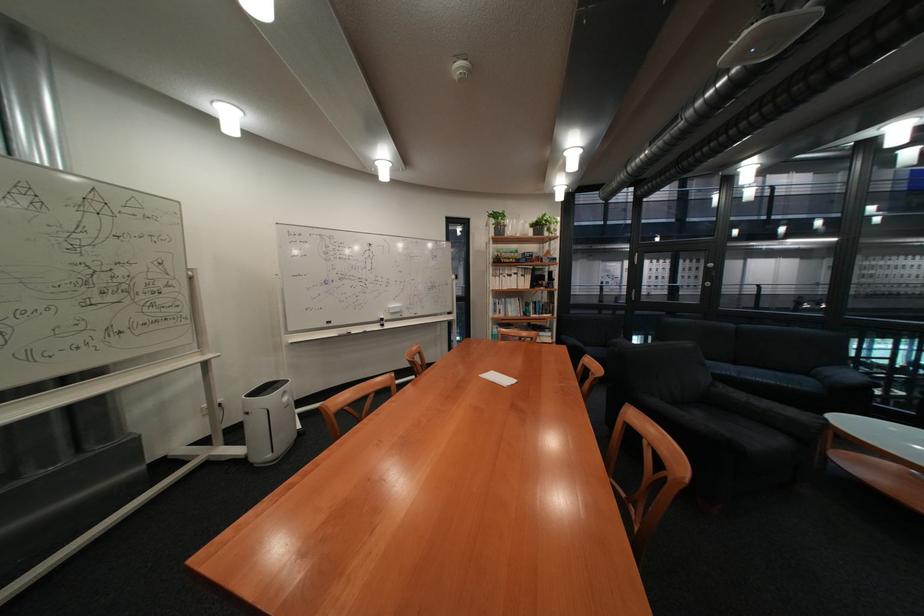
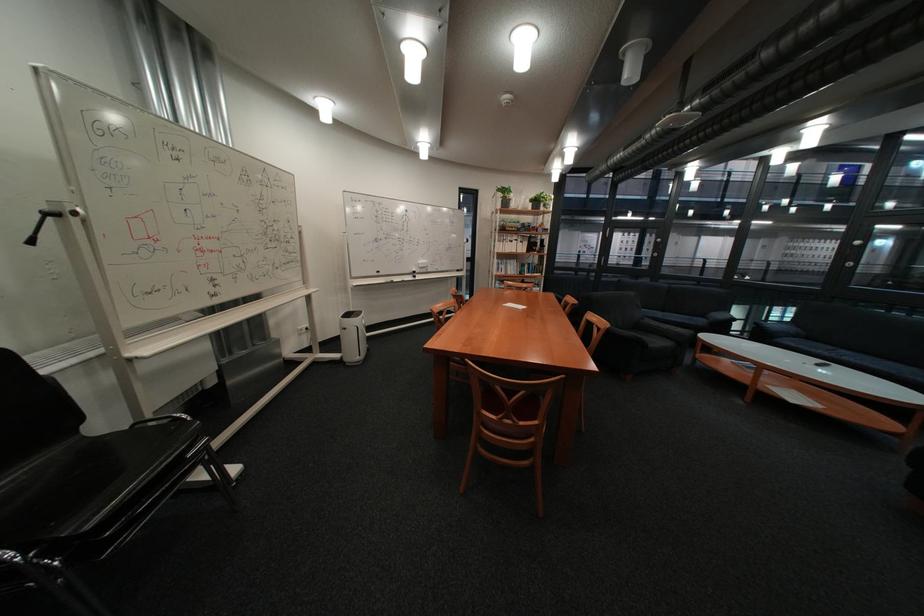
Find the pixel in the second image that matches (791,383) in the first image.

(698, 321)